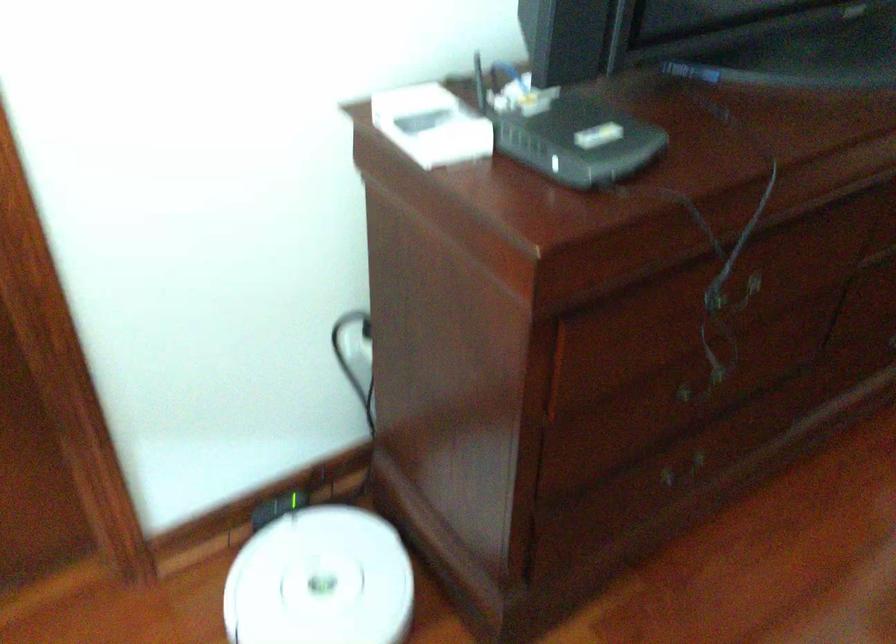
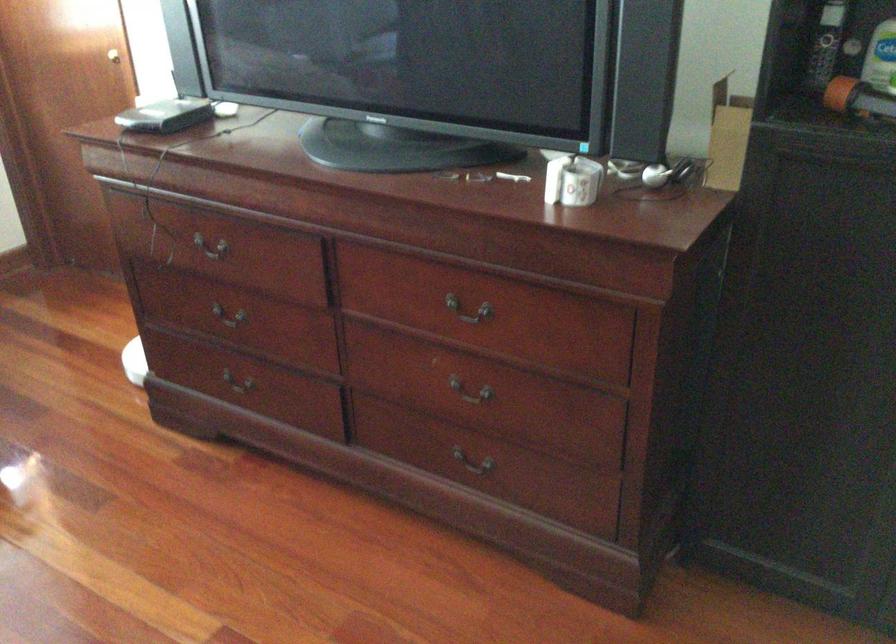
Locate, in the second image, the point that corresponds to pixel 631 377 in the first image.

(229, 313)